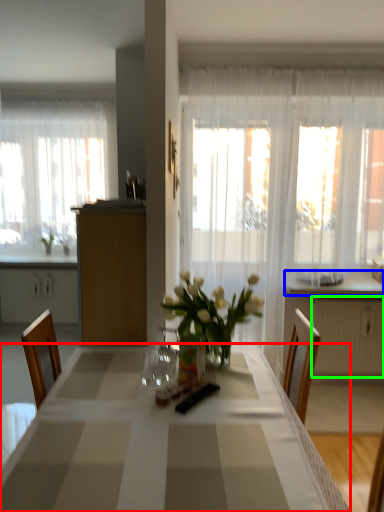
Question: Based on their relative distances, which object is nearer to desk (highlighted by a red box)? Choose from counter top (highlighted by a blue box) and radiator (highlighted by a green box).

Choices:
 (A) counter top
 (B) radiator

Answer: (B)